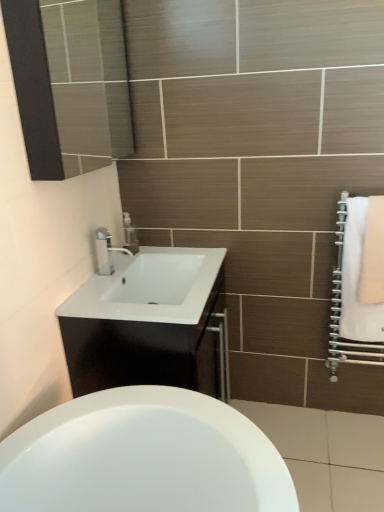
Question: Is clear plastic soap dispenser at upper center with white soft towel at right, arranged as the second bath towel when viewed from the right?

Choices:
 (A) yes
 (B) no

Answer: (B)

Question: From the image's perspective, is clear plastic soap dispenser at upper center on top of white soft towel at right, arranged as the first bath towel when viewed from the left?

Choices:
 (A) yes
 (B) no

Answer: (A)

Question: Could you tell me if clear plastic soap dispenser at upper center is turned towards white soft towel at right, arranged as the first bath towel when viewed from the left?

Choices:
 (A) yes
 (B) no

Answer: (A)

Question: From the image's perspective, is clear plastic soap dispenser at upper center located beneath white soft towel at right, arranged as the second bath towel when viewed from the right?

Choices:
 (A) no
 (B) yes

Answer: (A)

Question: Would you say clear plastic soap dispenser at upper center is outside white soft towel at right, arranged as the second bath towel when viewed from the right?

Choices:
 (A) yes
 (B) no

Answer: (A)

Question: Can you confirm if clear plastic soap dispenser at upper center is wider than white soft towel at right, arranged as the first bath towel when viewed from the left?

Choices:
 (A) yes
 (B) no

Answer: (A)

Question: Is white soft towel at right, the second bath towel viewed from the left, shorter than white glossy cabinet at center?

Choices:
 (A) yes
 (B) no

Answer: (A)

Question: Can you confirm if white soft towel at right, which appears as the 1th bath towel when viewed from the right, is bigger than white glossy cabinet at center?

Choices:
 (A) yes
 (B) no

Answer: (B)

Question: Would you consider white soft towel at right, which appears as the 1th bath towel when viewed from the right, to be distant from white glossy cabinet at center?

Choices:
 (A) yes
 (B) no

Answer: (B)

Question: Could white glossy cabinet at center be considered to be inside white soft towel at right, the second bath towel viewed from the left?

Choices:
 (A) yes
 (B) no

Answer: (B)

Question: Is white soft towel at right, the second bath towel viewed from the left, oriented towards white glossy cabinet at center?

Choices:
 (A) yes
 (B) no

Answer: (B)

Question: From a real-world perspective, is white soft towel at right, which appears as the 1th bath towel when viewed from the right, on top of white glossy cabinet at center?

Choices:
 (A) yes
 (B) no

Answer: (A)

Question: From a real-world perspective, is white soft towel at right, arranged as the second bath towel when viewed from the right, positioned under white soft towel at right, which appears as the 1th bath towel when viewed from the right, based on gravity?

Choices:
 (A) no
 (B) yes

Answer: (B)